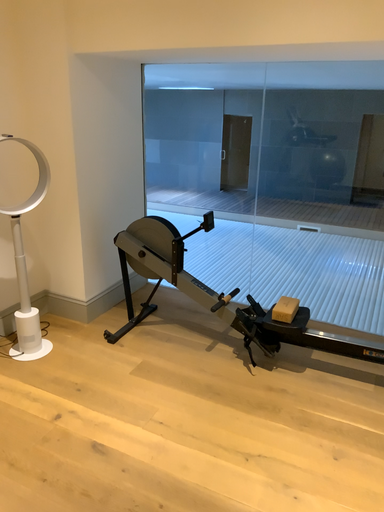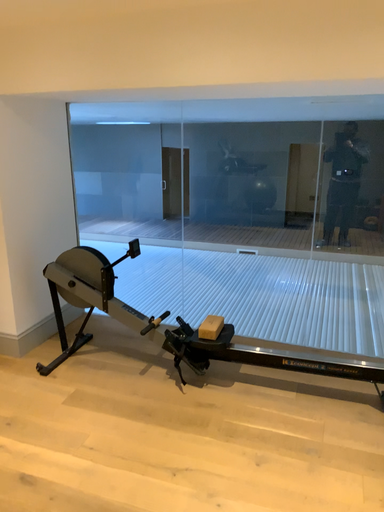
Question: Which way did the camera rotate in the video?

Choices:
 (A) rotated right
 (B) rotated left

Answer: (A)